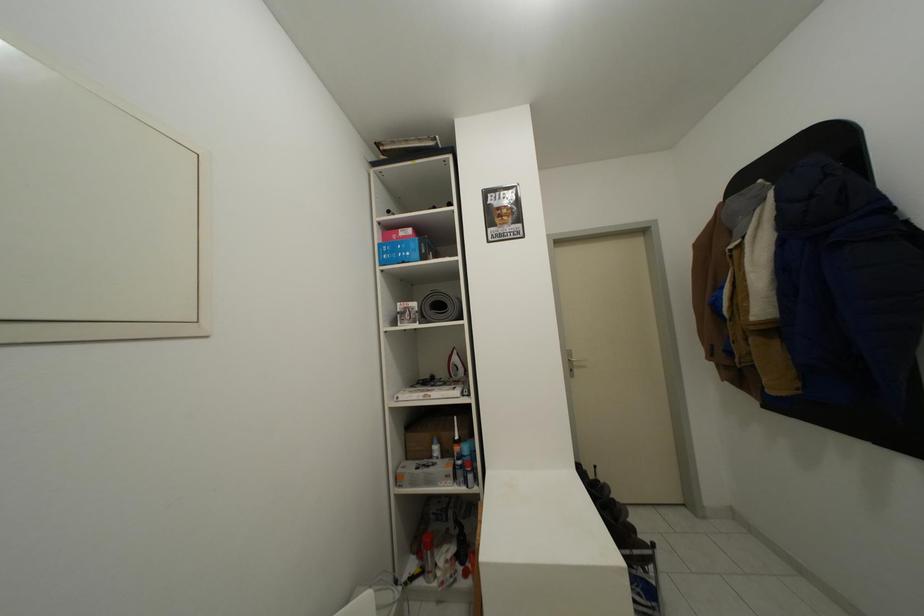
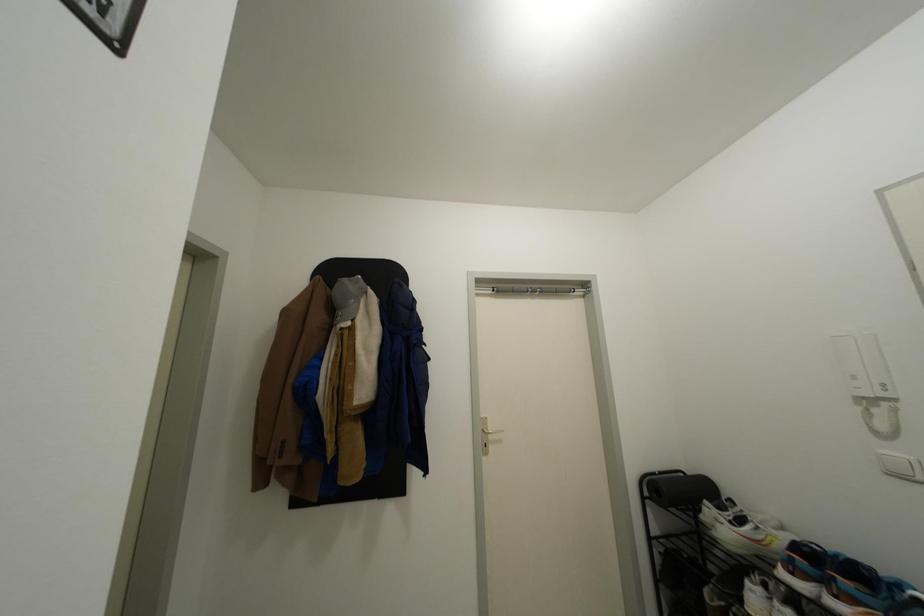
How did the camera likely rotate?

The rotation direction of the camera is right-up.